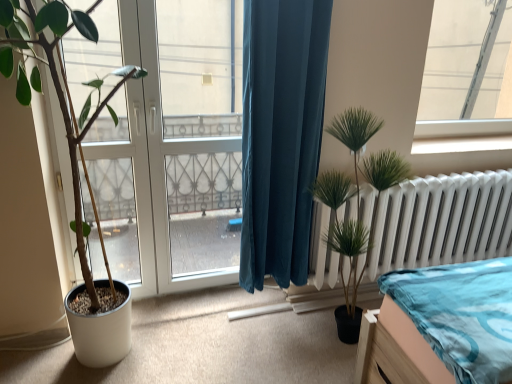
Question: From their relative heights in the image, would you say green artificial plant at right, the first houseplant positioned from the right, is taller or shorter than transparent glass door at center?

Choices:
 (A) tall
 (B) short

Answer: (B)

Question: From a real-world perspective, is green artificial plant at right, which appears as the second houseplant when viewed from the left, physically located above or below transparent glass door at center?

Choices:
 (A) above
 (B) below

Answer: (B)

Question: Which is nearer to the green artificial plant at right, the first houseplant positioned from the right?

Choices:
 (A) teal velvet curtain at center
 (B) transparent glass door at center
 (C) transparent glass door at left
 (D) transparent glass window at upper right
 (E) green matte plant at left, the 1th houseplant from the left

Answer: (A)

Question: Which is nearer to the transparent glass door at left?

Choices:
 (A) transparent glass door at center
 (B) transparent glass window at upper right
 (C) green artificial plant at right, which appears as the second houseplant when viewed from the left
 (D) green matte plant at left, positioned as the 2th houseplant in right-to-left order
 (E) teal velvet curtain at center

Answer: (A)